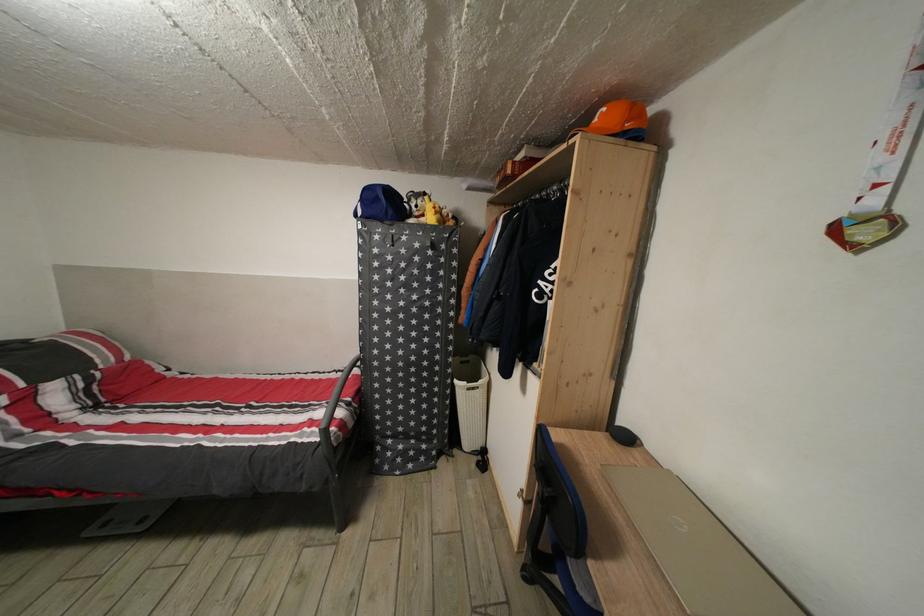
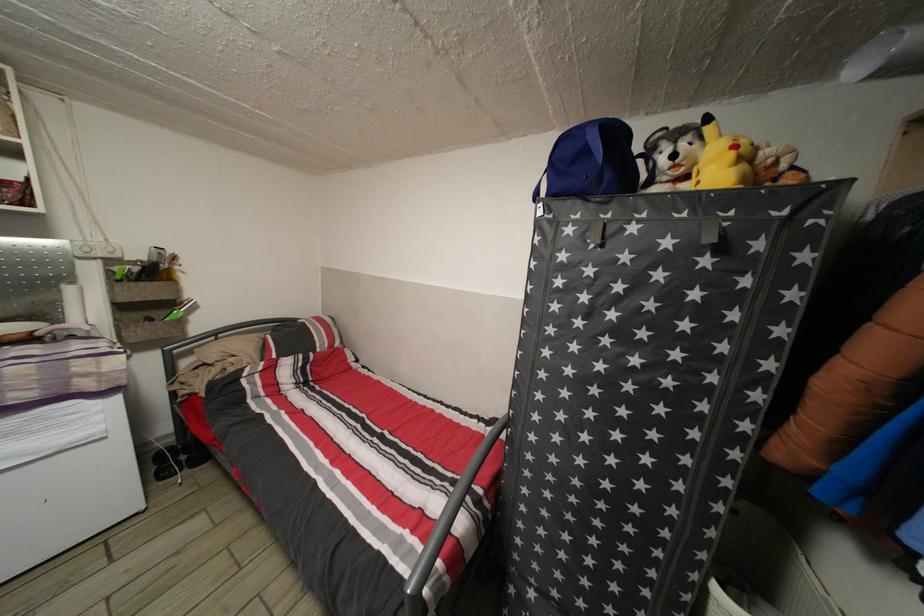
Locate, in the second image, the point that corresponds to (410,245) in the first image.

(639, 235)